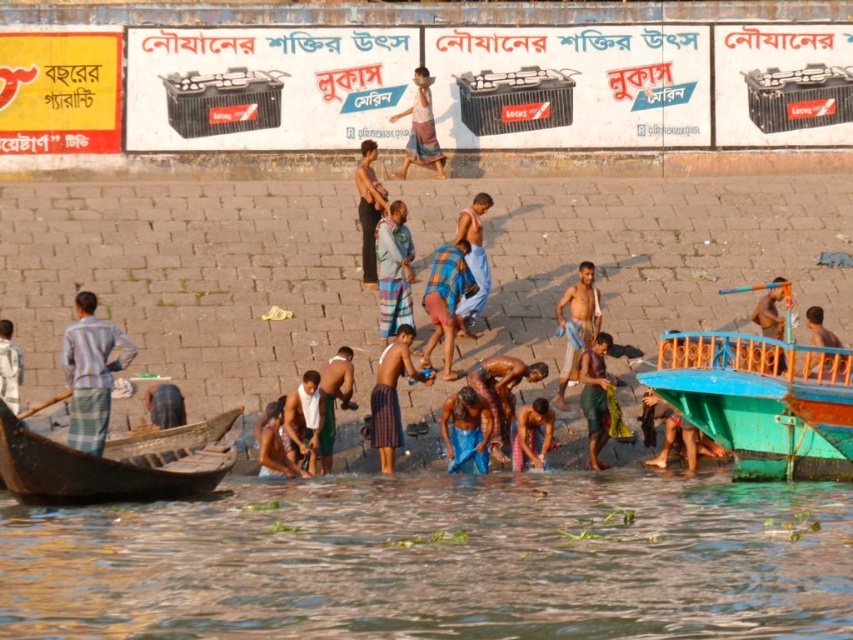
You are a tourist visiting the riverside and want to place your belongings on the white towel at lower center. However, there is an orange plastic paddle at center in the way. Can you move the paddle to access the towel?

The white towel at lower center is in front of the orange plastic paddle at center, meaning the paddle is behind the towel. Therefore, you can access the towel without moving the paddle.

You are a tourist standing on the riverside and want to take a photo of both the striped fabric pants at left and the light brown wooden boat at right. Which object should you frame first in your camera to ensure both are in the shot?

You should frame the striped fabric pants at left first since it is positioned to the left of the light brown wooden boat at right, ensuring both are included in the photo.

You are a tourist visiting the riverside and want to dry yourself after a swim. You see a white towel at lower center and an orange plastic paddle at center. Which item is closer to your left side?

The white towel at lower center is positioned on the left side of orange plastic paddle at center, so it is closer to your left side.